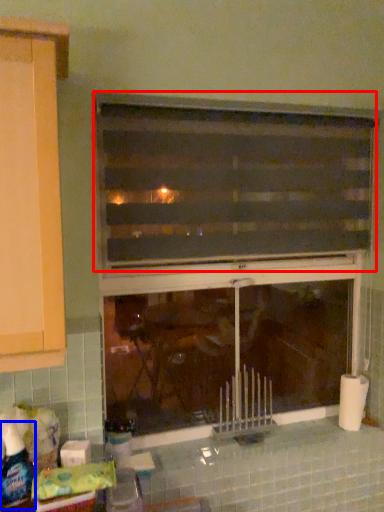
Question: Among these objects, which one is nearest to the camera, window (highlighted by a red box) or bottle (highlighted by a blue box)?

Choices:
 (A) window
 (B) bottle

Answer: (B)